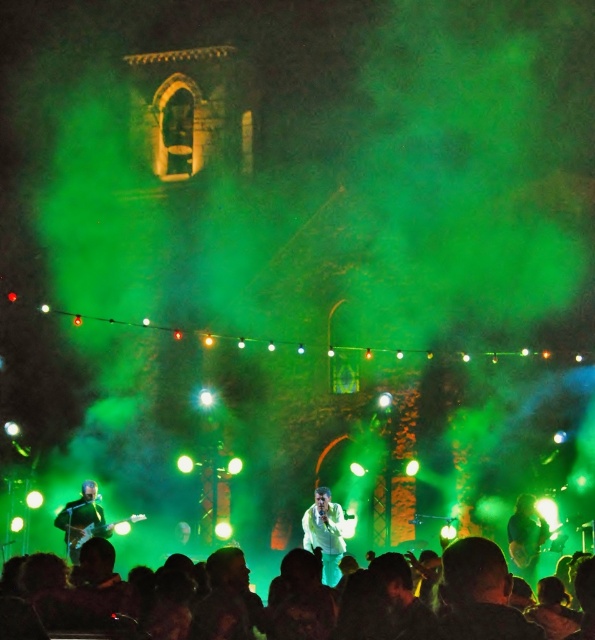
You are a photographer standing at the camera position. You want to capture a closeup shot of the white glossy shirt at center. Given that your camera can focus on objects within 10 meters, will you be able to take the closeup shot?

The white glossy shirt at center is 93.44 meters away from the camera, which is much farther than the camera can focus within 10 meters. Therefore, you cannot take a closeup shot of the white glossy shirt at center with the current camera settings.

You are a photographer at the live music performance. You want to capture a photo where both the white glossy shirt at center and the green fabric shirt at center are visible. Based on their positions, which shirt should you focus on to ensure both are in the frame?

The white glossy shirt at center is located above the green fabric shirt at center, so focusing on the white glossy shirt at center will ensure both are in the frame since it is positioned higher up.